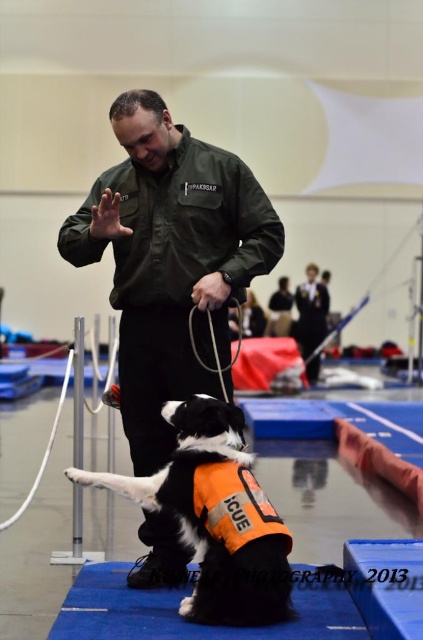
You are a photographer standing behind the man and want to take a photo of both the green matte shirt at center and the black and white fur at center. Since you can only focus on one subject at a time, which one should you focus on to ensure the other is also in focus?

The green matte shirt at center is located above black and white fur at center, so focusing on the green matte shirt at center will keep both subjects in focus as they are vertically aligned.

From the picture: You are a search and rescue team member and need to locate the orange fabric life jacket at center. According to the scene description, where exactly is the orange fabric life jacket positioned?

The orange fabric life jacket at center is located at point [233,506].

In the scene shown: You are a photographer standing behind the dog and want to take a photo of the man in the green matte shirt at center and the person in the dark blue uniform at center. Which one will be closer to the camera in the photo?

The green matte shirt at center is in front of the dark blue uniform at center, so the man in the green matte shirt at center will be closer to the camera in the photo.